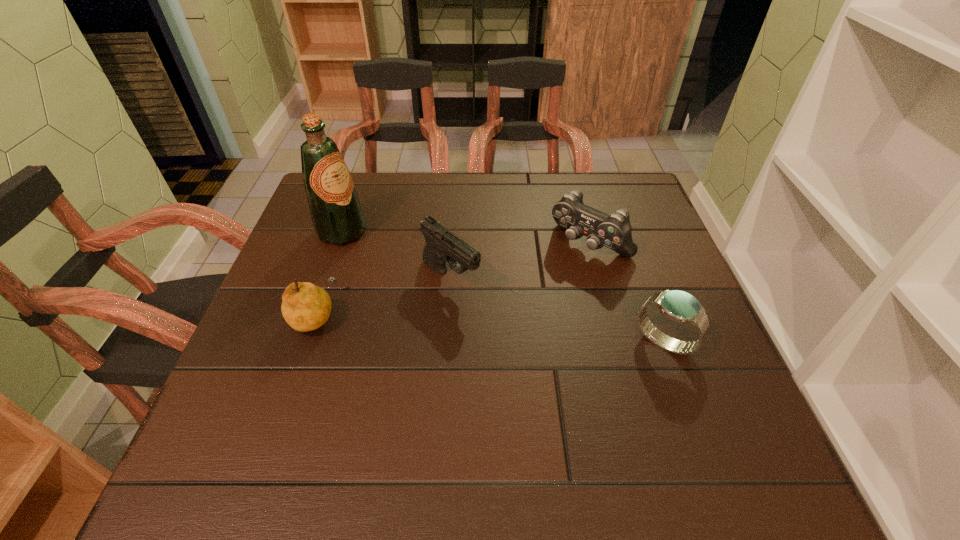
The width and height of the screenshot is (960, 540). In order to click on vacant point that satisfies the following two spatial constraints: 1. on the front side of the olive oil; 2. on the left side of the control in this screenshot , I will do `click(338, 245)`.

You are a GUI agent. You are given a task and a screenshot of the screen. Output one action in this format:
    pyautogui.click(x=<x>, y=<y>)
    Task: Click on the vacant region that satisfies the following two spatial constraints: 1. on the back side of the pear; 2. on the left side of the control
    The image size is (960, 540).
    Given the screenshot: What is the action you would take?
    pyautogui.click(x=339, y=245)

Where is `vacant space that satisfies the following two spatial constraints: 1. on the front side of the olive oil; 2. on the left side of the third object from right to left`? The image size is (960, 540). vacant space that satisfies the following two spatial constraints: 1. on the front side of the olive oil; 2. on the left side of the third object from right to left is located at coordinates (325, 279).